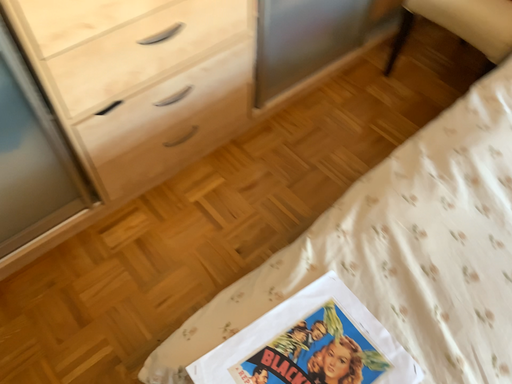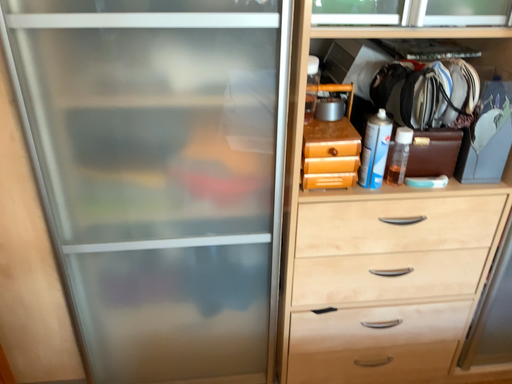
Question: Which way did the camera rotate in the video?

Choices:
 (A) rotated downward
 (B) rotated upward

Answer: (B)